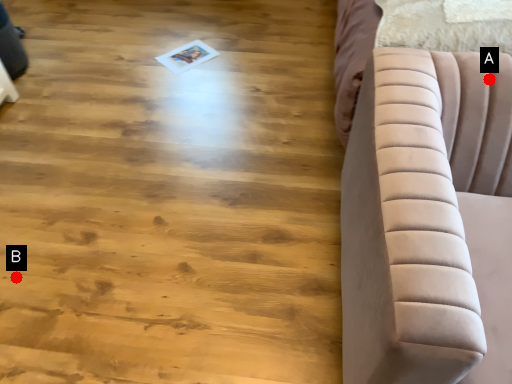
Question: Two points are circled on the image, labeled by A and B beside each circle. Which point appears closest to the camera in this image?

Choices:
 (A) A is closer
 (B) B is closer

Answer: (A)